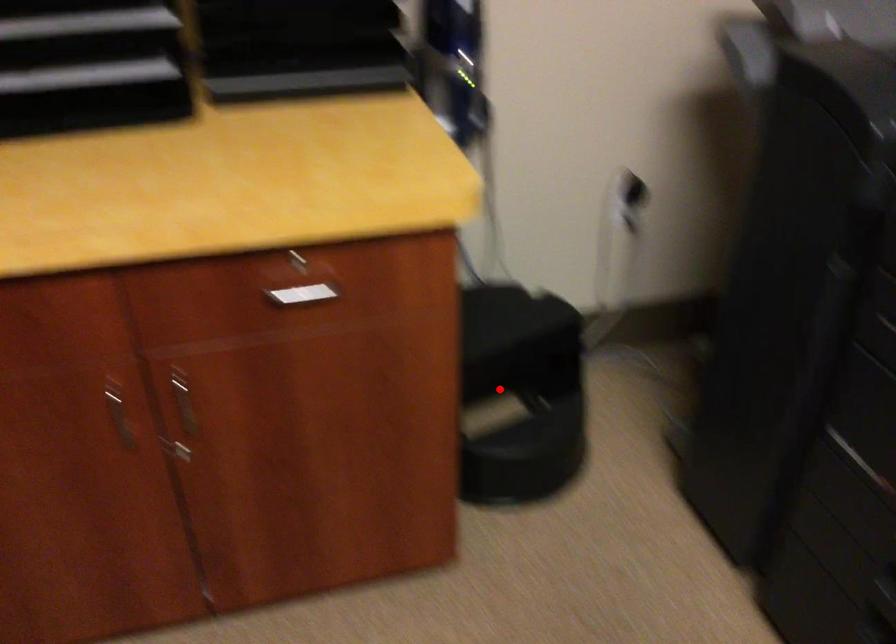
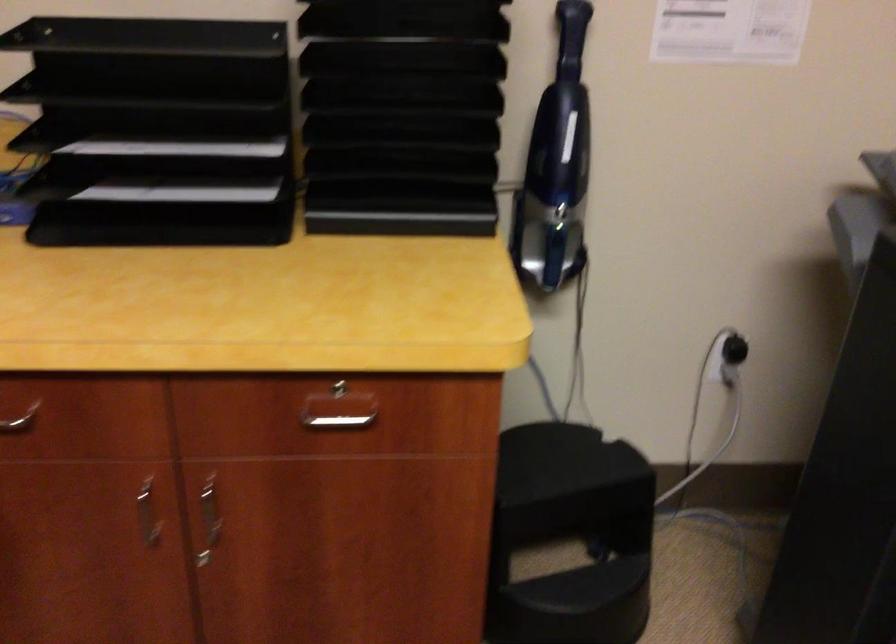
Find the pixel in the second image that matches the highlighted location in the first image.

(571, 536)